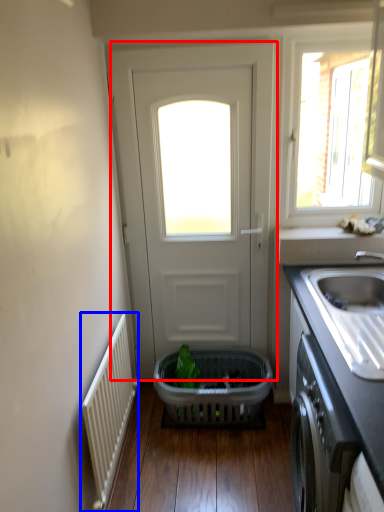
Question: Which point is further to the camera, door (highlighted by a red box) or radiator (highlighted by a blue box)?

Choices:
 (A) door
 (B) radiator

Answer: (A)